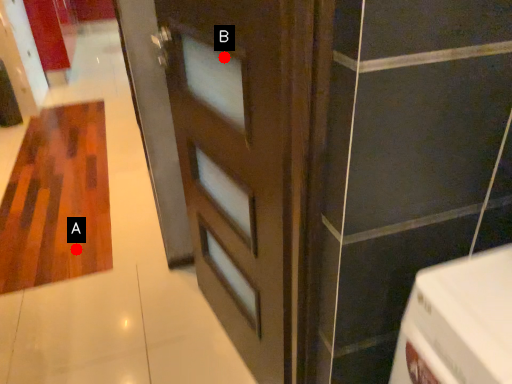
Question: Two points are circled on the image, labeled by A and B beside each circle. Which point is further to the camera?

Choices:
 (A) A is further
 (B) B is further

Answer: (A)